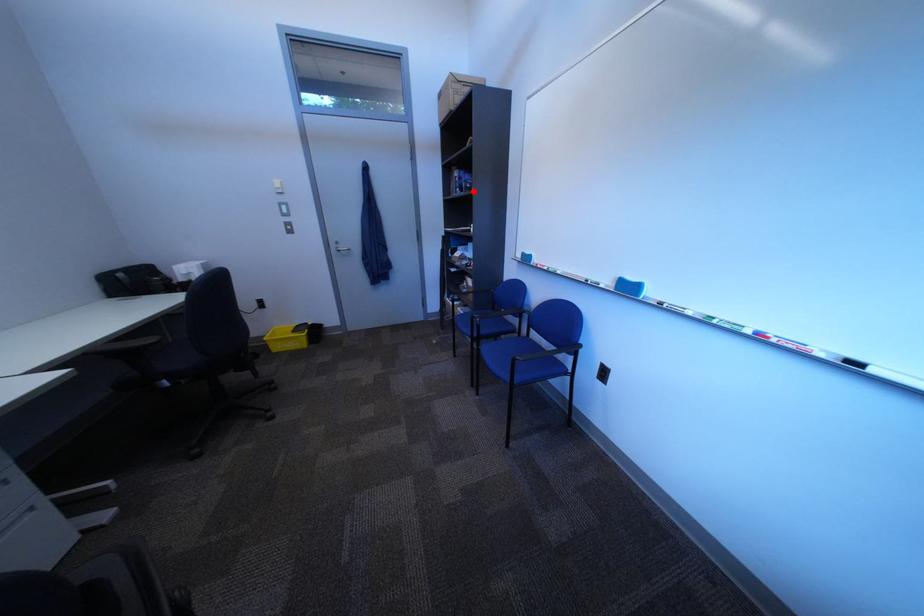
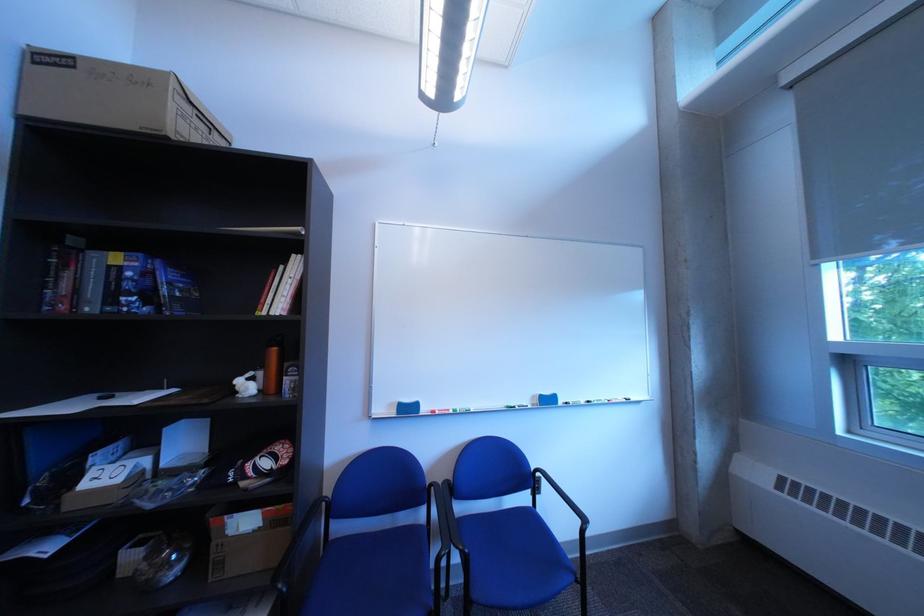
In the second image, find the point that corresponds to the highlighted location in the first image.

(150, 300)